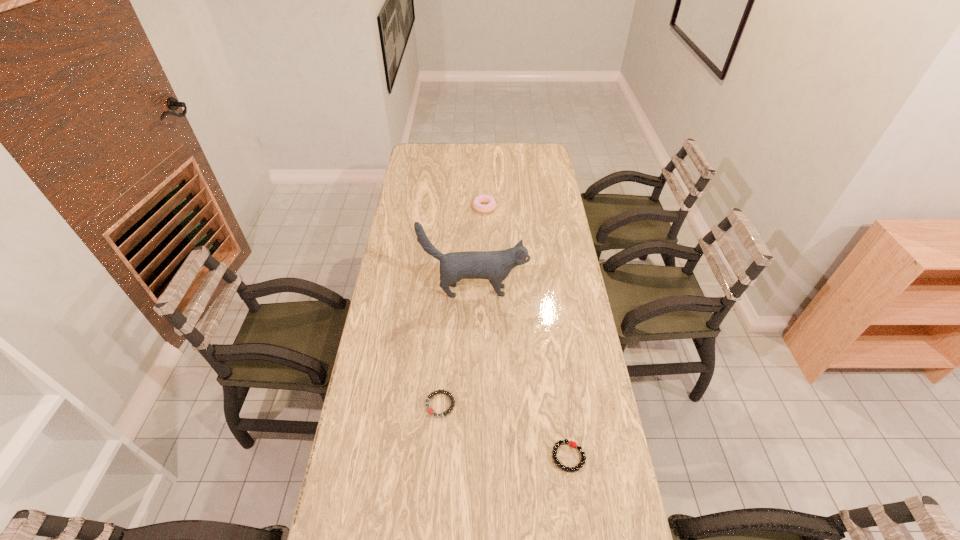
The width and height of the screenshot is (960, 540). I want to click on vacant region between the rightmost object and the tallest object, so click(521, 374).

Identify the location of empty space that is in between the rightmost object and the cat. This screenshot has width=960, height=540. (521, 374).

Find the location of a particular element. This screenshot has width=960, height=540. vacant area that lies between the cat and the right bracelet is located at coordinates (521, 374).

Image resolution: width=960 pixels, height=540 pixels. Find the location of `vacant point located between the doughnut and the nearer bracelet`. vacant point located between the doughnut and the nearer bracelet is located at coordinates (526, 332).

Where is `vacant area that lies between the farthest object and the right bracelet`? Image resolution: width=960 pixels, height=540 pixels. vacant area that lies between the farthest object and the right bracelet is located at coordinates (526, 332).

The image size is (960, 540). I want to click on empty space between the rightmost object and the farther bracelet, so click(504, 430).

Where is `vacant area that lies between the farther bracelet and the nearest object`? vacant area that lies between the farther bracelet and the nearest object is located at coordinates (504, 430).

Where is `object that stands as the third closest to the left bracelet`? The height and width of the screenshot is (540, 960). object that stands as the third closest to the left bracelet is located at coordinates (476, 204).

Choose which object is the nearest neighbor to the cat. Please provide its 2D coordinates. Your answer should be formatted as a tuple, i.e. [(x, y)], where the tuple contains the x and y coordinates of a point satisfying the conditions above.

[(430, 410)]

Where is `free spot that satisfies the following two spatial constraints: 1. at the face of the cat; 2. on the front side of the farther bracelet`? This screenshot has height=540, width=960. free spot that satisfies the following two spatial constraints: 1. at the face of the cat; 2. on the front side of the farther bracelet is located at coordinates (473, 404).